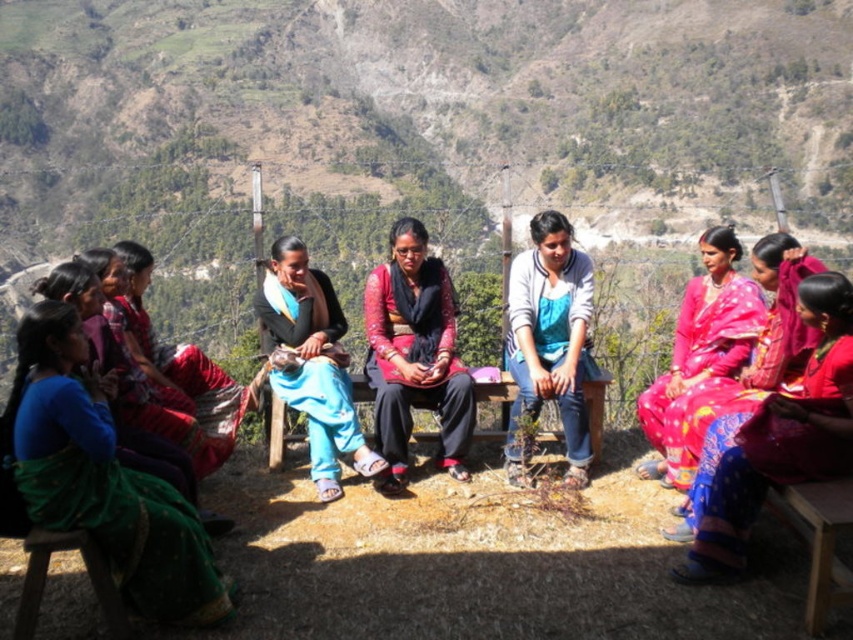
Can you confirm if vivid red saree at right is thinner than matte black pants at center?

No, vivid red saree at right is not thinner than matte black pants at center.

Consider the image. Who is positioned more to the left, vivid red saree at right or matte black pants at center?

From the viewer's perspective, matte black pants at center appears more on the left side.

Identify the location of vivid red saree at right. The height and width of the screenshot is (640, 853). (772, 442).

Can you confirm if matte black pants at center is positioned above wooden bench at center?

Correct, matte black pants at center is located above wooden bench at center.

Looking at this image, can you confirm if matte black pants at center is shorter than wooden bench at center?

No, matte black pants at center is not shorter than wooden bench at center.

Find the location of a particular element. matte black pants at center is located at coordinates click(415, 355).

Where is `matte black pants at center`? This screenshot has height=640, width=853. matte black pants at center is located at coordinates (415, 355).

Based on the photo, who is more distant from viewer, (97, 465) or (294, 372)?

Point (294, 372)

The height and width of the screenshot is (640, 853). In order to click on green silk saree at left in this screenshot , I will do `click(102, 477)`.

At what (x,y) coordinates should I click in order to perform the action: click on green silk saree at left. Please return your answer as a coordinate pair (x, y). The height and width of the screenshot is (640, 853). Looking at the image, I should click on (102, 477).